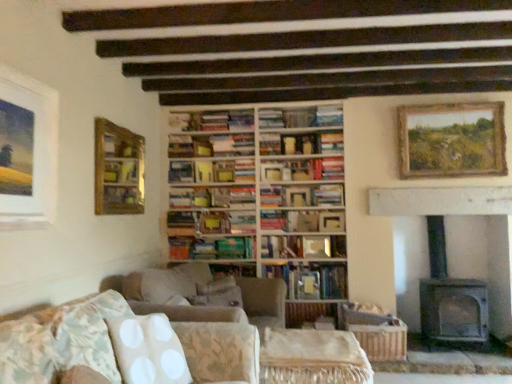
Locate an element on the screen. empty space that is ontop of hardcover book at center, acting as the 6th book starting from the bottom (from a real-world perspective) is located at coordinates (331, 184).